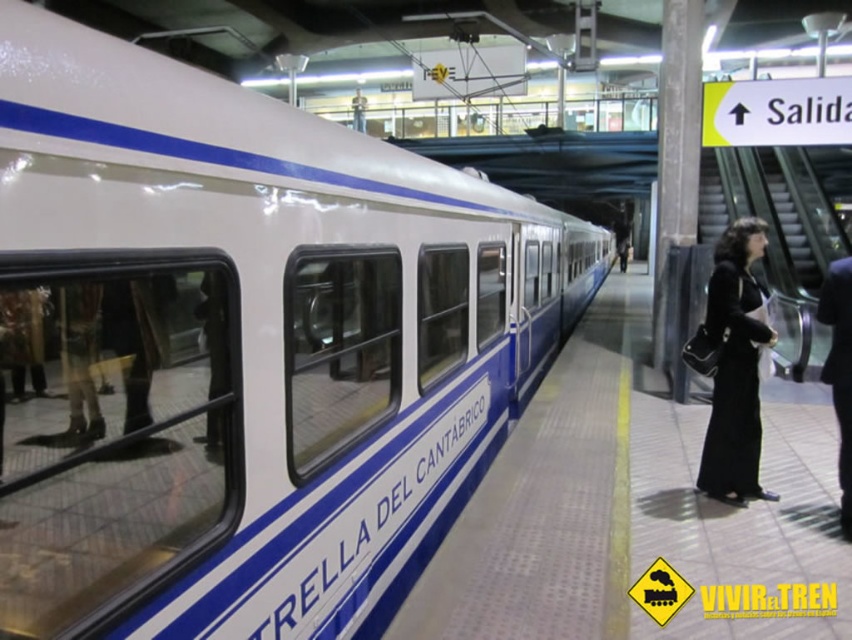
You are standing at the train station platform and want to take a photo of the point marked at coordinates (217, 260). If your camera has a maximum focus range of 6 feet, will you be able to capture the point clearly?

The distance of point (217, 260) from the camera is 6.64 feet, which exceeds the camera maximum focus range of 6 feet. Therefore, the point cannot be captured clearly.

You are standing on the platform and want to compare the height of the white glossy train at left and the black fabric coat at right. Which one is taller?

The white glossy train at left is taller than the black fabric coat at right.

You are standing on the train station platform. You see the white glossy train at left and the black fabric coat at right. Which object is positioned further to the left?

The white glossy train at left is positioned further to the left than the black fabric coat at right.